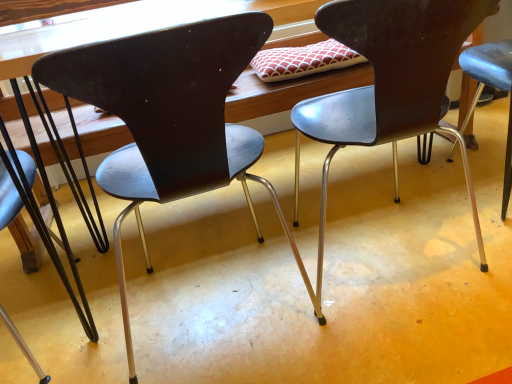
Question: Can you confirm if metallic black chair at center, acting as the 1th chair starting from the right, is thinner than matte black chair at center, the second chair viewed from the right?

Choices:
 (A) yes
 (B) no

Answer: (A)

Question: Considering the relative sizes of metallic black chair at center, acting as the 1th chair starting from the right, and matte black chair at center, the second chair positioned from the left, in the image provided, is metallic black chair at center, acting as the 1th chair starting from the right, shorter than matte black chair at center, the second chair positioned from the left,?

Choices:
 (A) yes
 (B) no

Answer: (A)

Question: Is metallic black chair at center, which is the 3th chair from left to right, positioned with its back to matte black chair at center, the second chair positioned from the left?

Choices:
 (A) no
 (B) yes

Answer: (A)

Question: Can matte black chair at center, the second chair viewed from the right, be found inside metallic black chair at center, which is the 3th chair from left to right?

Choices:
 (A) yes
 (B) no

Answer: (B)

Question: Is metallic black chair at center, acting as the 1th chair starting from the right, bigger than matte black chair at center, the second chair viewed from the right?

Choices:
 (A) yes
 (B) no

Answer: (B)

Question: From a real-world perspective, is metallic black chair at center, which is the 3th chair from left to right, located beneath matte black chair at center, the second chair viewed from the right?

Choices:
 (A) no
 (B) yes

Answer: (B)

Question: Is matte black chair at center, the second chair positioned from the left, outside metallic dark brown chair at left, which is the 1th chair in left-to-right order?

Choices:
 (A) yes
 (B) no

Answer: (A)

Question: Is matte black chair at center, the second chair viewed from the right, bigger than metallic dark brown chair at left, which is the 1th chair in left-to-right order?

Choices:
 (A) no
 (B) yes

Answer: (B)

Question: Does matte black chair at center, the second chair viewed from the right, have a lesser width compared to metallic dark brown chair at left, which is the 1th chair in left-to-right order?

Choices:
 (A) yes
 (B) no

Answer: (B)

Question: Is matte black chair at center, the second chair positioned from the left, at the right side of metallic dark brown chair at left, the 3th chair in the right-to-left sequence?

Choices:
 (A) yes
 (B) no

Answer: (A)

Question: Could you tell me if matte black chair at center, the second chair positioned from the left, is turned towards metallic dark brown chair at left, which is the 1th chair in left-to-right order?

Choices:
 (A) no
 (B) yes

Answer: (A)

Question: Is matte black chair at center, the second chair positioned from the left, looking in the opposite direction of metallic dark brown chair at left, the 3th chair in the right-to-left sequence?

Choices:
 (A) no
 (B) yes

Answer: (A)

Question: Is metallic dark brown chair at left, which is the 1th chair in left-to-right order, not within metallic black chair at center, acting as the 1th chair starting from the right?

Choices:
 (A) yes
 (B) no

Answer: (A)